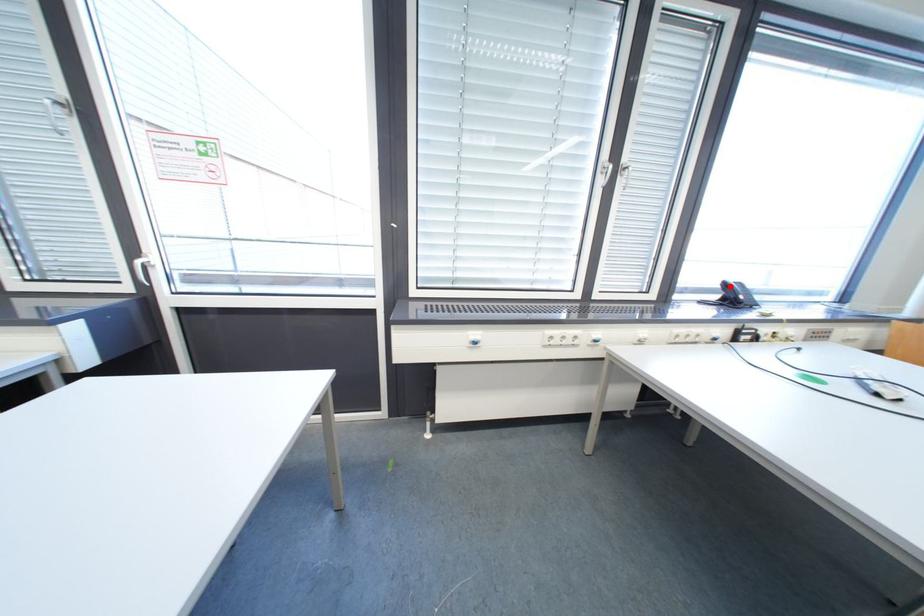
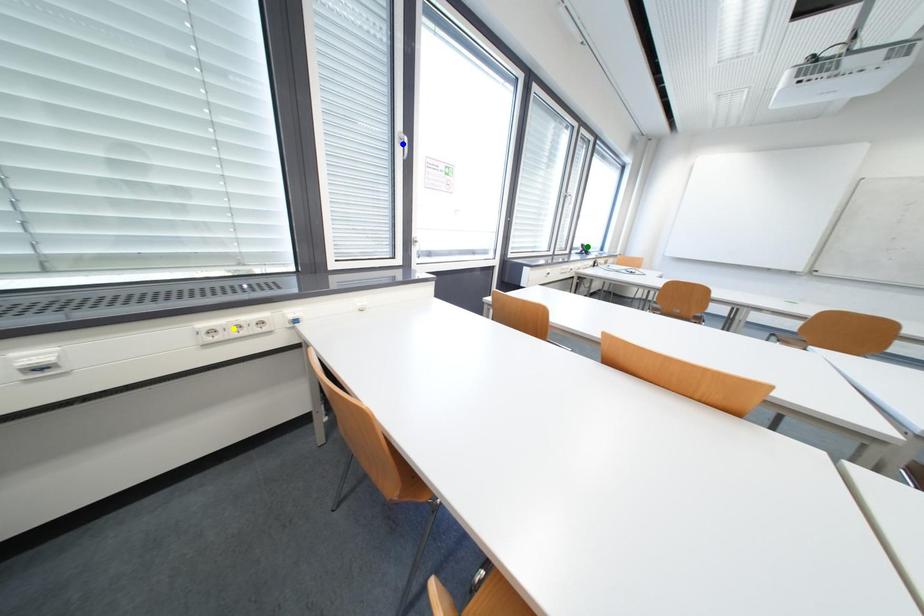
Question: I am providing you with two images of the same scene from different viewpoints. A red point is marked on the first image. You are given multiple points on the second image. Can you choose the point in image 2 that corresponds to the point in image 1?

Choices:
 (A) yellow point
 (B) blue point
 (C) green point

Answer: (C)